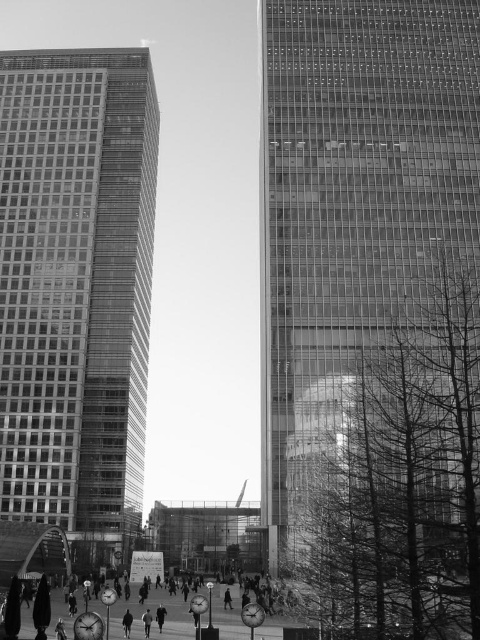
Who is taller, glassy reflective skyscraper at left or dark gray clothing at center?

Standing taller between the two is glassy reflective skyscraper at left.

Measure the distance between point (23,268) and camera.

The distance of point (23,268) from camera is 108.99 meters.

Is point (64, 298) closer to viewer compared to point (145, 625)?

No.

Locate an element on the screen. glassy reflective skyscraper at left is located at coordinates (75, 291).

Which is more to the right, glassy reflective skyscraper at right or dark gray clothing at center?

glassy reflective skyscraper at right is more to the right.

Between point (447, 6) and point (143, 614), which one is positioned in front?

Point (143, 614)

Identify the location of glassy reflective skyscraper at right. This screenshot has height=640, width=480. (354, 205).

Does glassy reflective skyscraper at right have a lesser height compared to glassy reflective skyscraper at left?

Correct, glassy reflective skyscraper at right is not as tall as glassy reflective skyscraper at left.

Does glassy reflective skyscraper at right have a lesser width compared to glassy reflective skyscraper at left?

Incorrect, glassy reflective skyscraper at right's width is not less than glassy reflective skyscraper at left's.

Does point (399, 109) come closer to viewer compared to point (14, 74)?

Yes, point (399, 109) is in front of point (14, 74).

Locate an element on the screen. Image resolution: width=480 pixels, height=640 pixels. glassy reflective skyscraper at right is located at coordinates (354, 205).